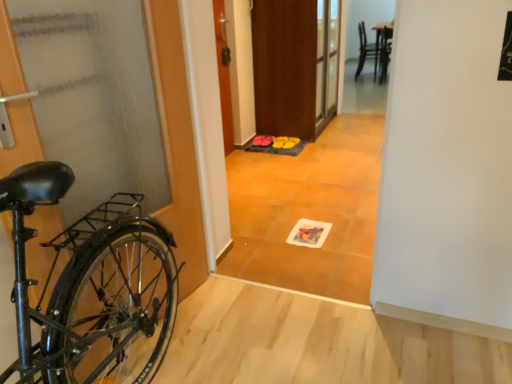
Question: Is wooden door at center, arranged as the second door when viewed from the front, bigger or smaller than matte pink shoes at center?

Choices:
 (A) small
 (B) big

Answer: (B)

Question: Does point (228, 122) appear closer or farther from the camera than point (267, 135)?

Choices:
 (A) farther
 (B) closer

Answer: (B)

Question: Considering the real-world distances, which object is farthest from the matte gray door at left, placed as the 2th door when sorted from back to front?

Choices:
 (A) brown wooden screen door at center
 (B) wooden door at center, arranged as the second door when viewed from the front
 (C) matte pink shoes at center
 (D) matte orange floor mat at center
 (E) wooden chair at upper right

Answer: (E)

Question: Which of these objects is positioned closest to the matte pink shoes at center?

Choices:
 (A) wooden chair at upper right
 (B) wooden door at center, the first door when ordered from top to bottom
 (C) matte orange floor mat at center
 (D) matte gray door at left, placed as the 2th door when sorted from top to bottom
 (E) brown wooden screen door at center

Answer: (B)